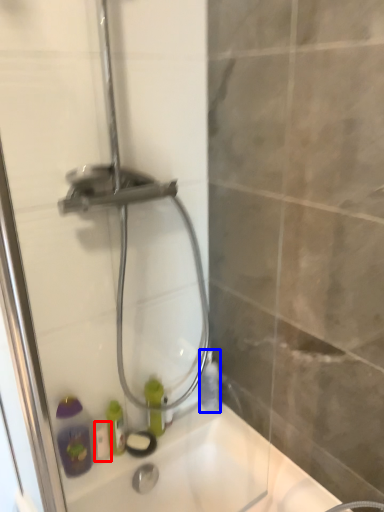
Question: Which point is further to the camera, toiletry (highlighted by a red box) or bottle (highlighted by a blue box)?

Choices:
 (A) toiletry
 (B) bottle

Answer: (B)